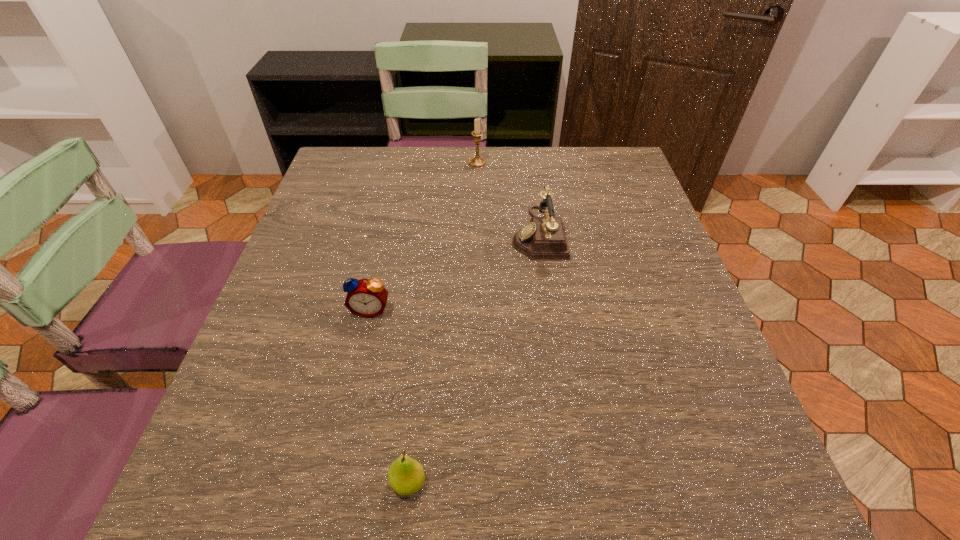
Locate an element on the screen. the tallest object is located at coordinates (477, 161).

In order to click on the second object from right to left in this screenshot , I will do `click(477, 161)`.

The image size is (960, 540). In order to click on the second farthest object in this screenshot , I will do pos(544,238).

In order to click on telephone in this screenshot , I will do `click(544, 238)`.

Identify the location of the leftmost object. (367, 298).

Where is `alarm clock`? The width and height of the screenshot is (960, 540). alarm clock is located at coordinates (367, 298).

Where is `the nearest object`? the nearest object is located at coordinates (406, 476).

In order to click on pear in this screenshot , I will do `click(406, 476)`.

Where is `free space located on the right of the candle holder`? free space located on the right of the candle holder is located at coordinates (504, 163).

The height and width of the screenshot is (540, 960). Find the location of `vacant area located on the dial of the rightmost object`. vacant area located on the dial of the rightmost object is located at coordinates (388, 233).